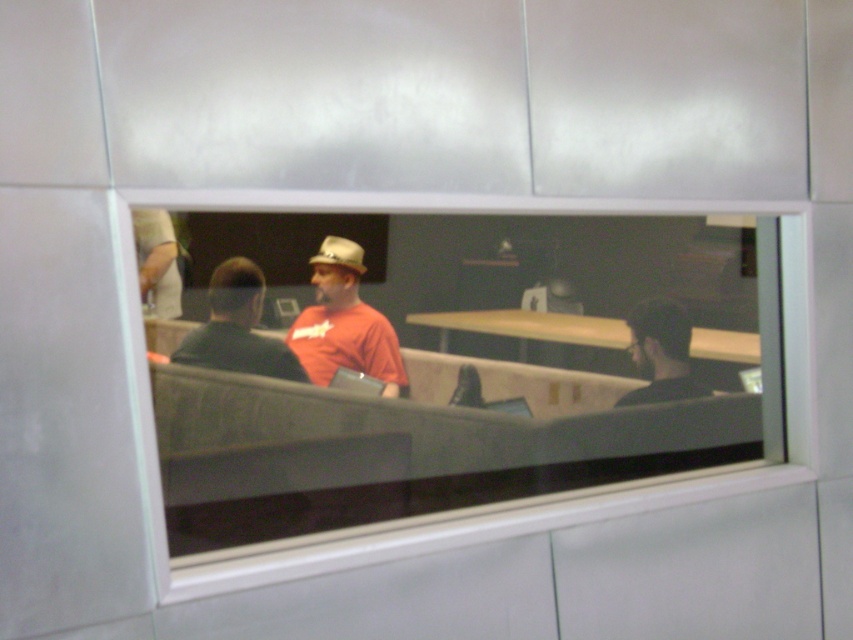
Question: Which point is closer to the camera?

Choices:
 (A) dark gray shirt at right
 (B) wooden at center
 (C) light brown felt cowboy hat at center
 (D) matte orange shirt at center

Answer: (A)

Question: Considering the relative positions of matte orange shirt at center and black matte shirt at left in the image provided, where is matte orange shirt at center located with respect to black matte shirt at left?

Choices:
 (A) left
 (B) right

Answer: (B)

Question: Among these objects, which one is nearest to the camera?

Choices:
 (A) wooden at center
 (B) light brown felt cowboy hat at center
 (C) dark gray shirt at right

Answer: (C)

Question: Can you confirm if matte orange shirt at center is wider than light brown felt cowboy hat at center?

Choices:
 (A) no
 (B) yes

Answer: (B)

Question: Does clear glass window at center have a greater width compared to black matte shirt at left?

Choices:
 (A) no
 (B) yes

Answer: (B)

Question: Which point is farther to the camera?

Choices:
 (A) (669, 310)
 (B) (392, 376)
 (C) (509, 323)
 (D) (703, 236)

Answer: (D)